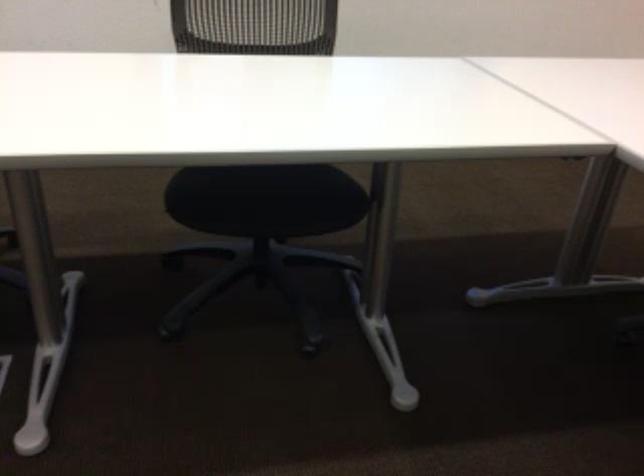
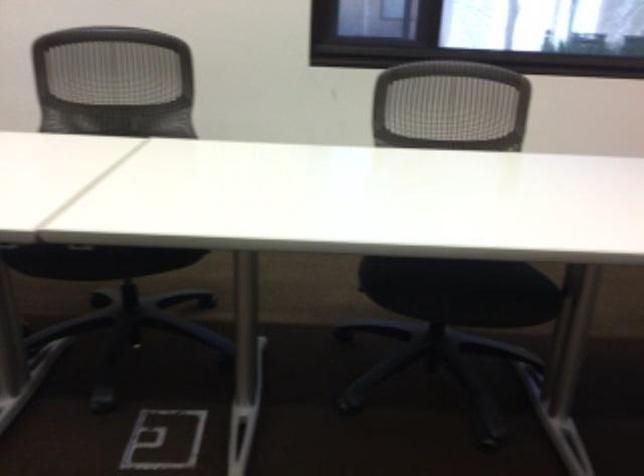
What movement of the cameraman would produce the second image?

The cameraman walked toward left, backward.